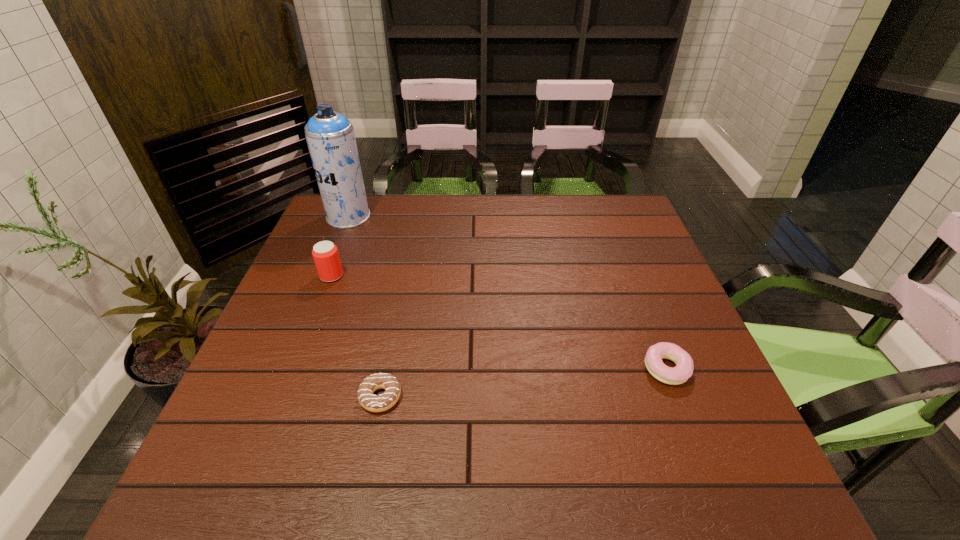
Identify the location of vacant region between the left doughnut and the third nearest object. The image size is (960, 540). (356, 336).

Identify the location of free space between the aerosol can and the third shortest object. (340, 246).

The height and width of the screenshot is (540, 960). Identify the location of object that stands as the second closest to the second farthest object. (386, 400).

Locate an element on the screen. object that can be found as the closest to the rightmost object is located at coordinates (386, 400).

Locate an element on the screen. The width and height of the screenshot is (960, 540). free location that satisfies the following two spatial constraints: 1. on the front side of the third nearest object; 2. on the right side of the right doughnut is located at coordinates (296, 369).

Find the location of a particular element. vacant region that satisfies the following two spatial constraints: 1. on the front side of the shorter doughnut; 2. on the right side of the second farthest object is located at coordinates (285, 397).